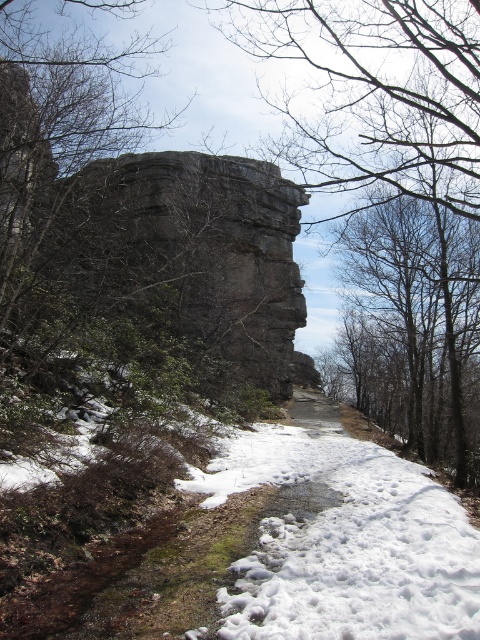
You are a hiker trying to navigate the path in the winter landscape. You see the smooth gray rock at center and the white fluffy snow at center. Which object is positioned to the right of the other?

The smooth gray rock at center is to the right of the white fluffy snow at center.

You are an explorer trying to cross the path in the winter scene. You see a smooth gray rock at center and white fluffy snow at center. Which object is bigger in size?

The smooth gray rock at center has a larger size compared to the white fluffy snow at center, so the smooth gray rock at center is bigger.

You are an explorer trying to cross the path in the winter scene. You notice a smooth gray rock at center and white fluffy snow at center. Which object is taller?

The smooth gray rock at center is taller than the white fluffy snow at center.